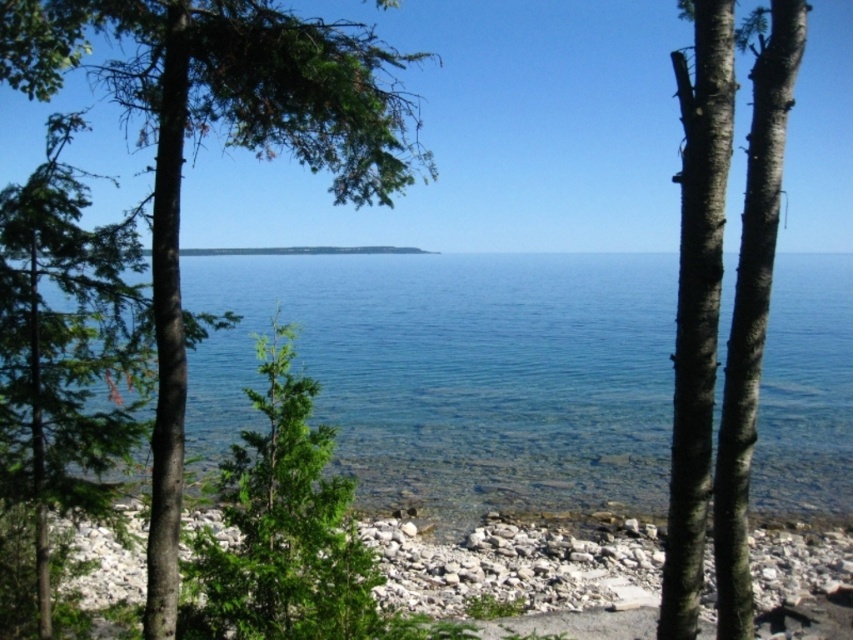
Question: Which point appears closest to the camera in this image?

Choices:
 (A) (583, 595)
 (B) (796, 19)
 (C) (389, 129)
 (D) (549, 403)

Answer: (B)

Question: Can you confirm if green leafy tree at left is positioned to the left of smooth bark tree at right?

Choices:
 (A) yes
 (B) no

Answer: (A)

Question: Does clear blue water at center have a greater width compared to green leafy tree at left?

Choices:
 (A) yes
 (B) no

Answer: (A)

Question: Which point is farther to the camera?

Choices:
 (A) clear blue water at center
 (B) green leafy tree at left

Answer: (B)

Question: Estimate the real-world distances between objects in this image. Which object is farther from the green leafy tree at left?

Choices:
 (A) white pebbles at lower center
 (B) smooth bark tree at right

Answer: (B)

Question: Does green leafy tree at left come behind white pebbles at lower center?

Choices:
 (A) yes
 (B) no

Answer: (B)